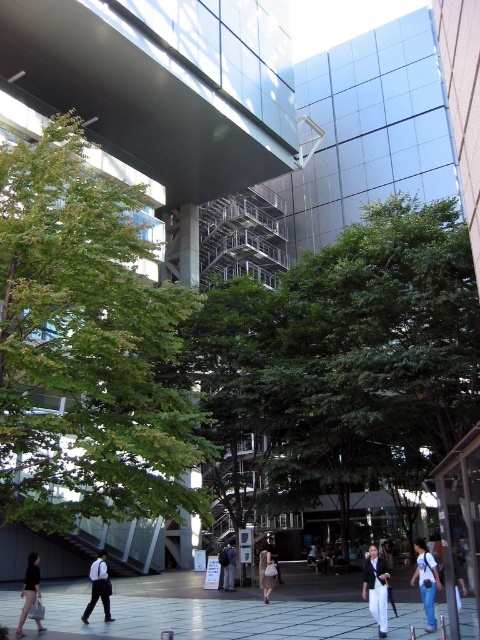
Measure the distance between green leafy tree at center and camera.

green leafy tree at center is 51.05 feet from camera.

Does green leafy tree at center have a greater width compared to dark gray suit at center?

Indeed, green leafy tree at center has a greater width compared to dark gray suit at center.

Is point (400, 285) behind point (231, 582)?

That is False.

The height and width of the screenshot is (640, 480). I want to click on green leafy tree at center, so click(344, 360).

Is green leafy tree at center taller than denim jeans at lower right?

Indeed, green leafy tree at center has a greater height compared to denim jeans at lower right.

Who is higher up, green leafy tree at center or denim jeans at lower right?

Positioned higher is green leafy tree at center.

Find the location of a particular element. The height and width of the screenshot is (640, 480). green leafy tree at center is located at coordinates (344, 360).

Which is above, denim jeans at lower right or dark gray suit at center?

denim jeans at lower right is higher up.

The image size is (480, 640). I want to click on denim jeans at lower right, so click(425, 580).